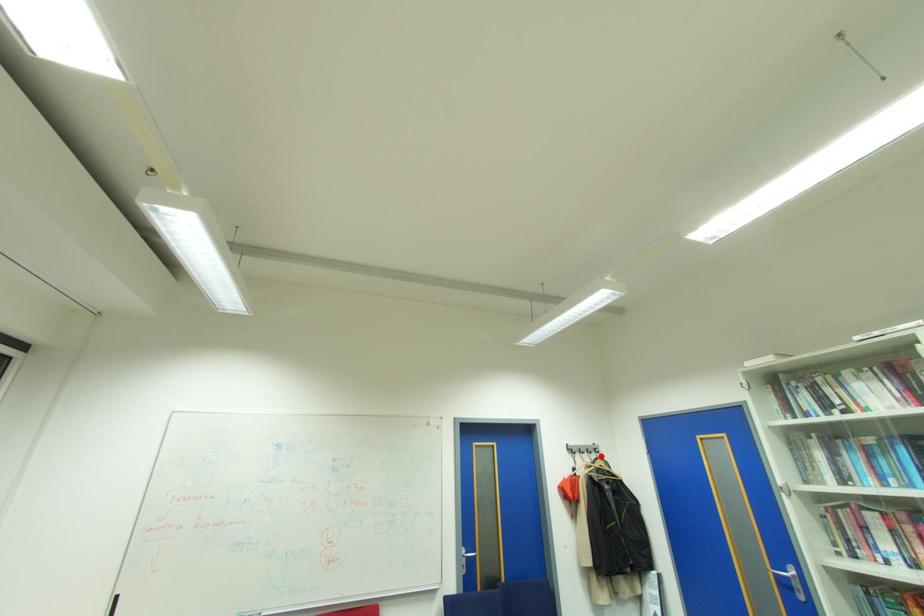
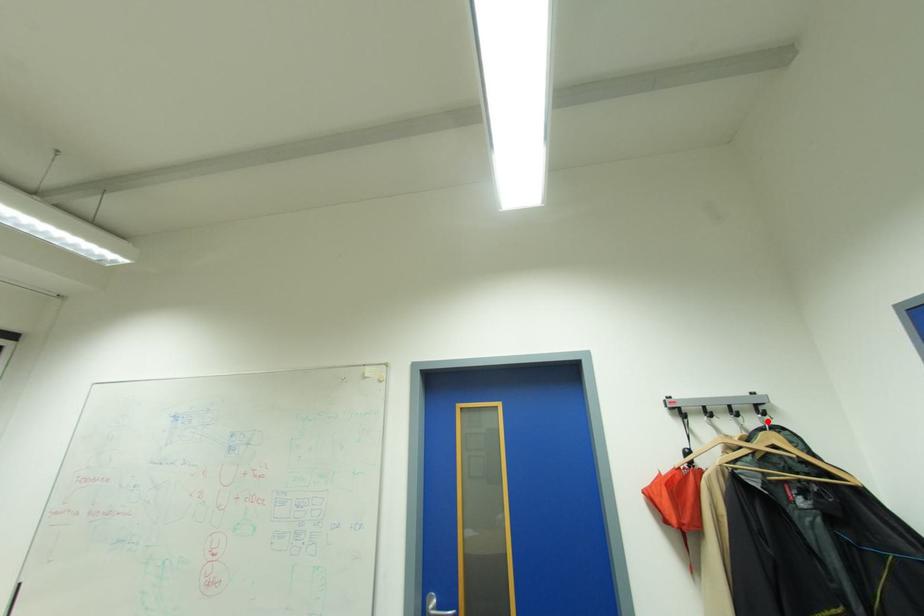
I am providing you with two images of the same scene from different viewpoints. A red point is marked on the first image and another point is marked on the second image. Does the point marked in image1 correspond to the same location as the one in image2?

Yes